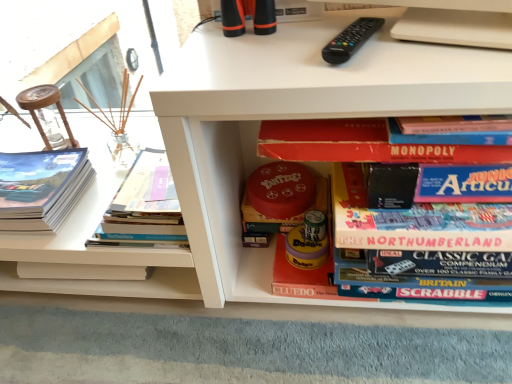
Where is `free space in front of black plastic remote at upper center`? Image resolution: width=512 pixels, height=384 pixels. free space in front of black plastic remote at upper center is located at coordinates point(380,72).